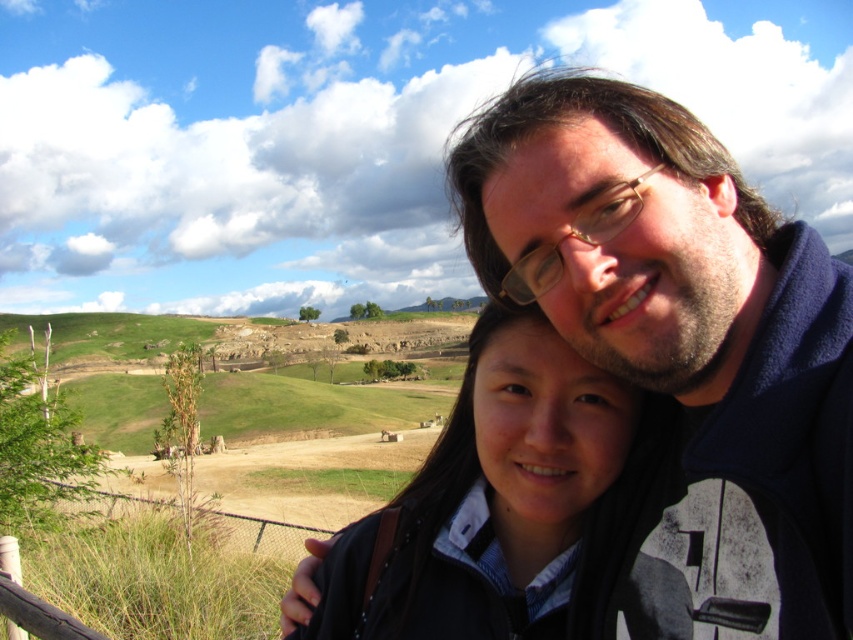
Looking at this image, which of these two, dark blue fleece at upper right or dark brown hair at center, stands taller?

dark blue fleece at upper right is taller.

Which is below, dark blue fleece at upper right or dark brown hair at center?

dark brown hair at center is lower down.

Measure the distance between point (471, 221) and camera.

17.70 meters

Where is `dark blue fleece at upper right`? dark blue fleece at upper right is located at coordinates (682, 348).